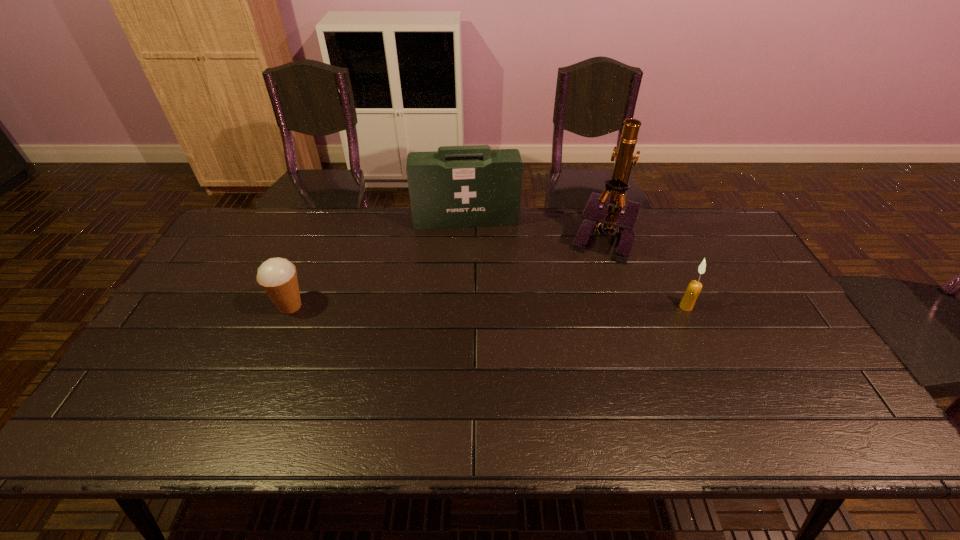
Find the location of a particular element. vacant space located 0.150m on the front-facing side of the third shortest object is located at coordinates (471, 259).

Locate an element on the screen. The image size is (960, 540). vacant space located 0.390m at the eyepiece of the second object from right to left is located at coordinates (493, 318).

Locate an element on the screen. The height and width of the screenshot is (540, 960). free region located 0.350m at the eyepiece of the second object from right to left is located at coordinates (503, 310).

Identify the location of vacant area situated at the eyepiece of the second object from right to left. This screenshot has height=540, width=960. (561, 269).

Locate an element on the screen. The height and width of the screenshot is (540, 960). the first-aid kit at the far edge is located at coordinates (469, 190).

What are the coordinates of `microscope that is at the far edge` in the screenshot? It's located at (619, 219).

At what (x,y) coordinates should I click in order to perform the action: click on free space at the far edge of the desktop. Please return your answer as a coordinate pair (x, y). The width and height of the screenshot is (960, 540). Looking at the image, I should click on (535, 232).

Identify the location of vacant region at the near edge of the desktop. This screenshot has height=540, width=960. (408, 376).

Where is `vacant region at the right edge`? The image size is (960, 540). vacant region at the right edge is located at coordinates (715, 256).

This screenshot has height=540, width=960. I want to click on free space at the far left corner of the desktop, so click(x=269, y=239).